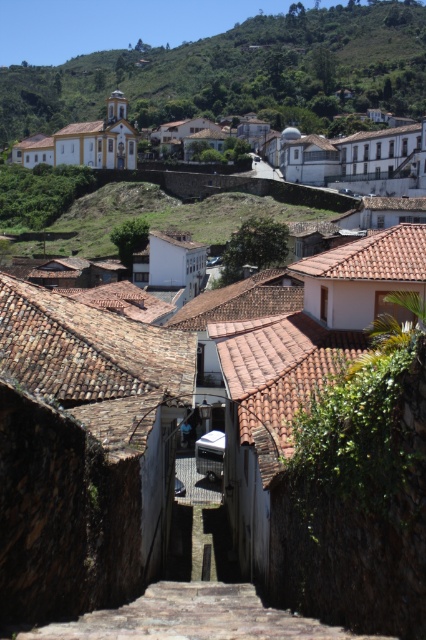
You are a tourist standing at the entrance of the cobblestone street in the historic town. You see the green grassy hillside at upper center and the yellow painted church at upper left. Which of these two landmarks is narrower from side to side?

The green grassy hillside at upper center is thinner than the yellow painted church at upper left, so the green grassy hillside at upper center is narrower from side to side.

You are standing at the base of the green leafy hillside at upper center in the historic town. You want to reach the top of the hillside to enjoy a panoramic view. If your average walking speed is 5 km per hour, how long would it take you to climb the hillside?

The distance between the green leafy hillside at upper center and the viewer is 226.68 meters. Converting this to kilometers, it becomes 0.22668 km. At a walking speed of 5 km per hour, the time required would be 0.22668 km divided by 5 km per hour, which equals approximately 0.0453 hours. Multiplying this by 60 minutes gives roughly 2.72 minutes. Therefore, it would take about 2.7 minutes to climb the hillside.

You are standing at the center of the cobblestone street in the historic town and looking towards the cluster of buildings. There is a point marked at coordinates (152, 202). What does this point indicate in the scene?

The point at (152, 202) indicates the green grassy hillside at upper center.